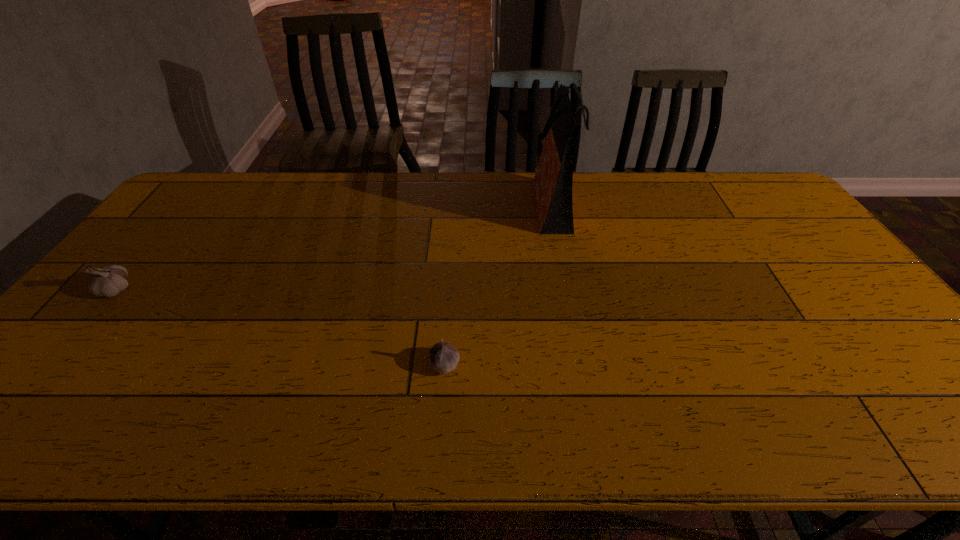
Identify the location of free spot that satisfies the following two spatial constraints: 1. on the front side of the rightmost object; 2. on the front side of the nearer garlic. (586, 364).

Image resolution: width=960 pixels, height=540 pixels. I want to click on vacant area in the image that satisfies the following two spatial constraints: 1. on the front side of the taller garlic; 2. on the left side of the right garlic, so click(56, 364).

Locate an element on the screen. This screenshot has height=540, width=960. vacant space that satisfies the following two spatial constraints: 1. on the front side of the second shortest object; 2. on the left side of the nearer garlic is located at coordinates (56, 364).